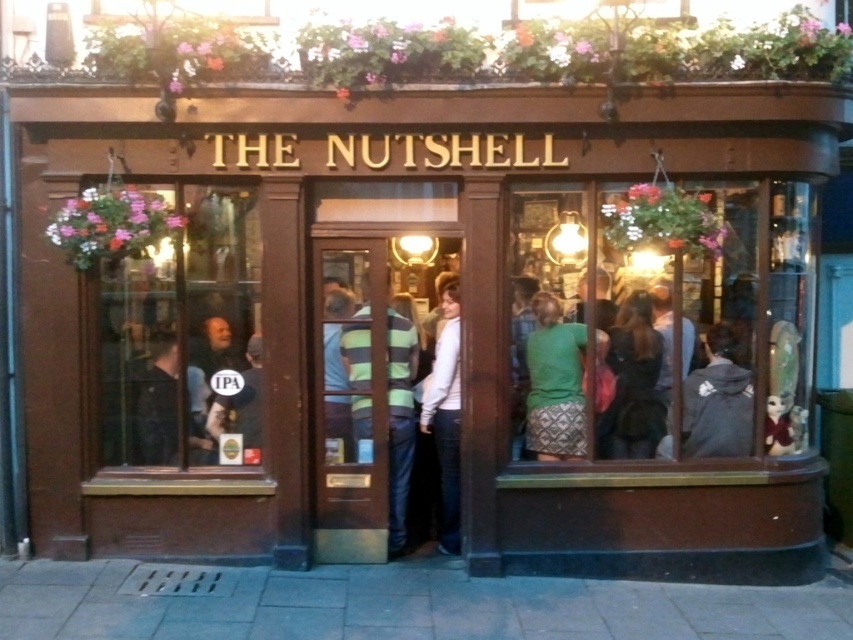
You are standing outside the pub and want to know which object is taller between the dark brown leather jacket at lower right and the matte black signboard at lower left. Can you tell me?

The dark brown leather jacket at lower right is taller than the matte black signboard at lower left according to the description.

You are standing at the entrance of The Nutshell pub and notice a dark brown leather jacket at lower right. If you want to retrieve it, which direction should you move relative to the entrance?

To retrieve the dark brown leather jacket at lower right, you should move to the right side of the entrance since it is located at the lower right position relative to the entrance.

You are a customer standing in front of the entrance of The Nutshell pub. You want to hang a new coat rack between the green textured sweater at center and the green striped sweater at center. The coat rack requires 1 meter of space between the two sweaters to be installed. Can you install the coat rack there?

The green textured sweater at center and the green striped sweater at center are 1.18 meters apart from each other. Since the required space for the coat rack is 1 meter, the distance between them is sufficient. Therefore, the coat rack can be installed between them.